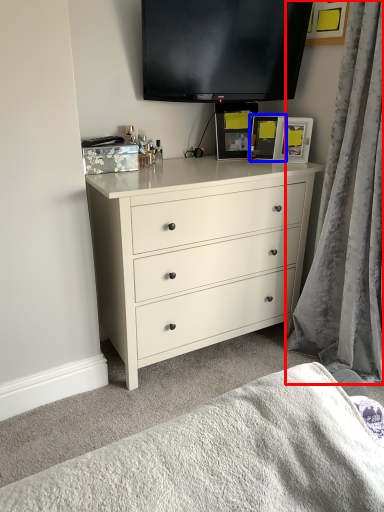
Question: Which object is closer to the camera taking this photo, curtain (highlighted by a red box) or picture frame (highlighted by a blue box)?

Choices:
 (A) curtain
 (B) picture frame

Answer: (A)